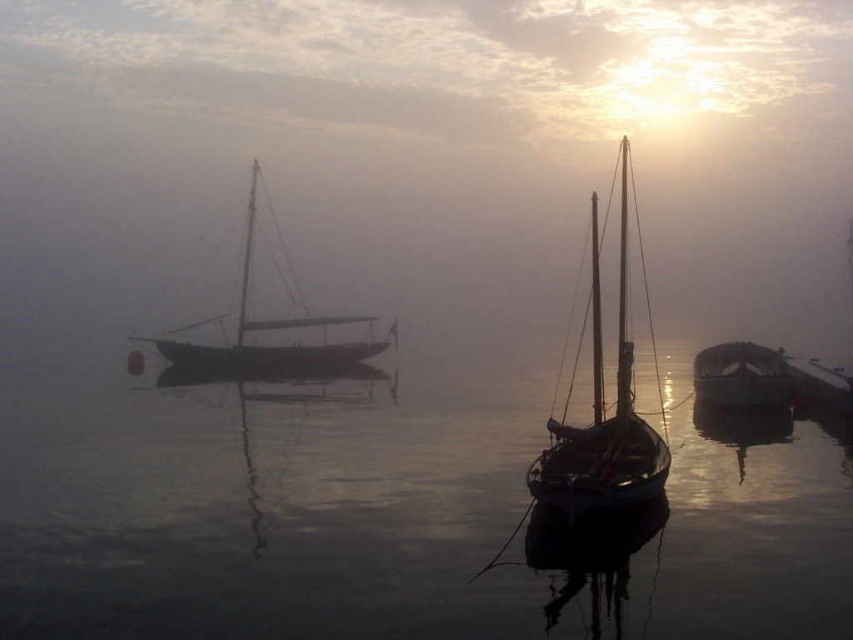
Question: Is wooden sailboat at left closer to the viewer compared to shiny dark wood boat at right?

Choices:
 (A) no
 (B) yes

Answer: (A)

Question: Observing the image, what is the correct spatial positioning of transparent water at center in reference to wooden sailboat at left?

Choices:
 (A) below
 (B) above

Answer: (A)

Question: Which object appears closest to the camera in this image?

Choices:
 (A) transparent water at center
 (B) shiny dark wood boat at right
 (C) shiny dark wood sailboat at center

Answer: (A)

Question: Estimate the real-world distances between objects in this image. Which object is closer to the shiny dark wood boat at right?

Choices:
 (A) shiny dark wood sailboat at center
 (B) wooden sailboat at left

Answer: (B)

Question: Which of the following is the closest to the observer?

Choices:
 (A) shiny dark wood sailboat at center
 (B) shiny dark wood boat at right

Answer: (A)

Question: Does shiny dark wood sailboat at center have a smaller size compared to wooden sailboat at left?

Choices:
 (A) no
 (B) yes

Answer: (B)